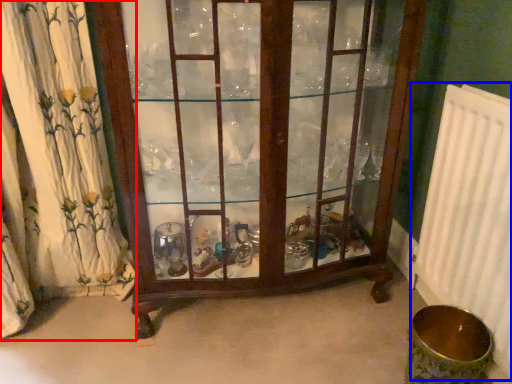
Question: Which of the following is the closest to the observer, curtain (highlighted by a red box) or radiator (highlighted by a blue box)?

Choices:
 (A) curtain
 (B) radiator

Answer: (B)